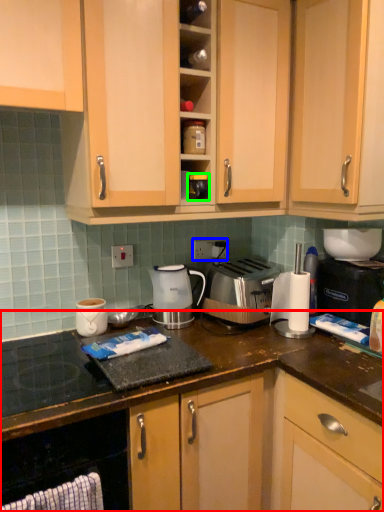
Question: Which object is the farthest from cabinetry (highlighted by a red box)? Choose among these: electric outlet (highlighted by a blue box) or appliance (highlighted by a green box).

Choices:
 (A) electric outlet
 (B) appliance

Answer: (B)